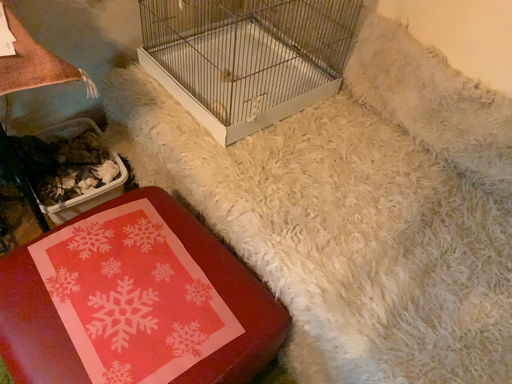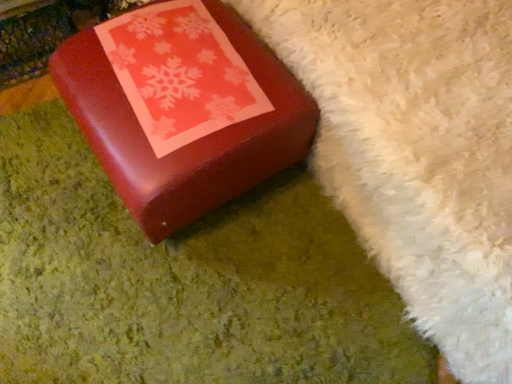
Question: Which way did the camera rotate in the video?

Choices:
 (A) rotated downward
 (B) rotated upward

Answer: (A)